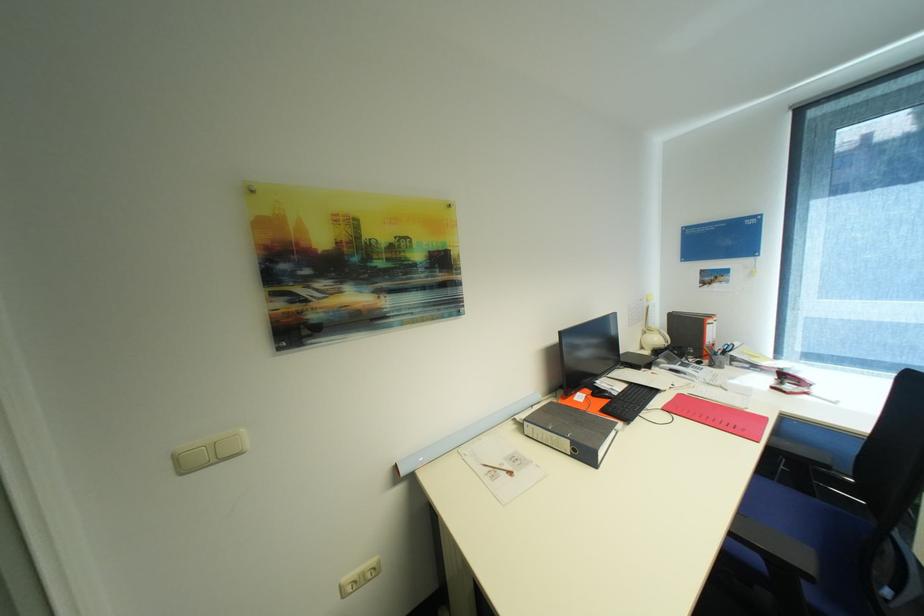
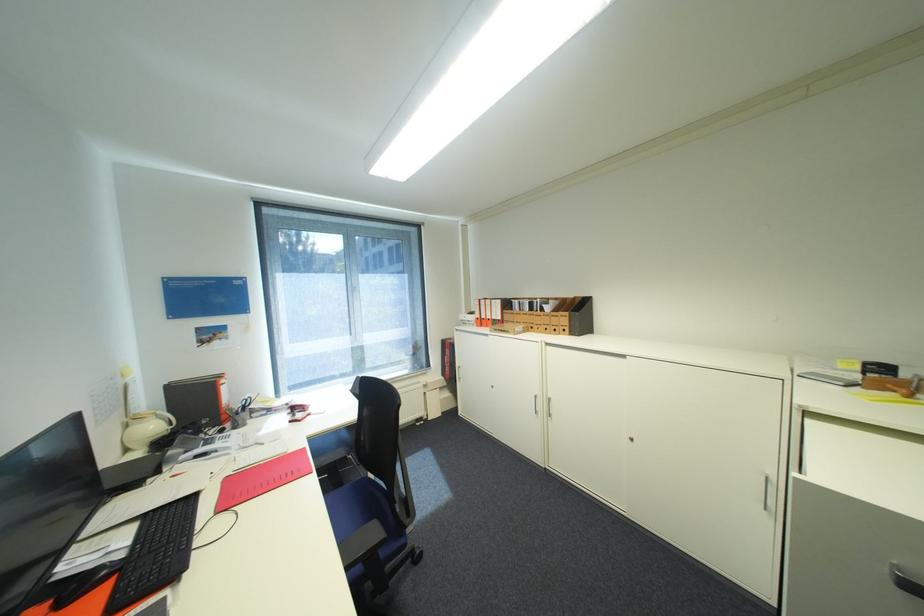
In the second image, find the point that corresponds to (663,339) in the first image.

(161, 427)